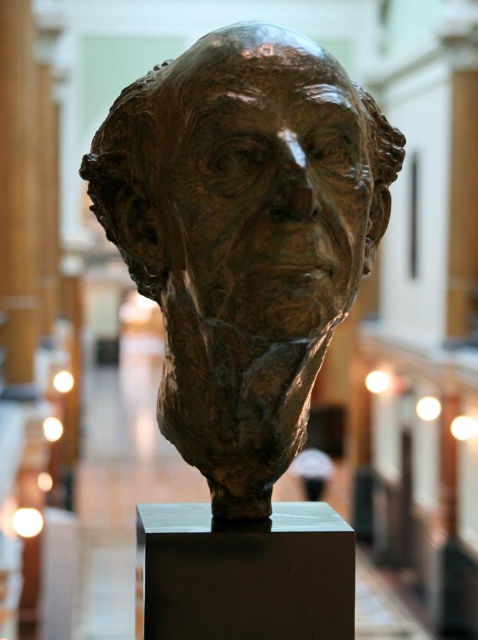
Question: Which point is closer to the camera?

Choices:
 (A) matte black pedestal at center
 (B) bronze sculpture at center

Answer: (B)

Question: Does bronze sculpture at center have a greater width compared to matte black pedestal at center?

Choices:
 (A) no
 (B) yes

Answer: (B)

Question: Does bronze sculpture at center appear on the left side of matte black pedestal at center?

Choices:
 (A) no
 (B) yes

Answer: (B)

Question: Which object is farther from the camera taking this photo?

Choices:
 (A) matte black pedestal at center
 (B) bronze sculpture at center

Answer: (A)

Question: Does bronze sculpture at center appear on the left side of matte black pedestal at center?

Choices:
 (A) yes
 (B) no

Answer: (A)